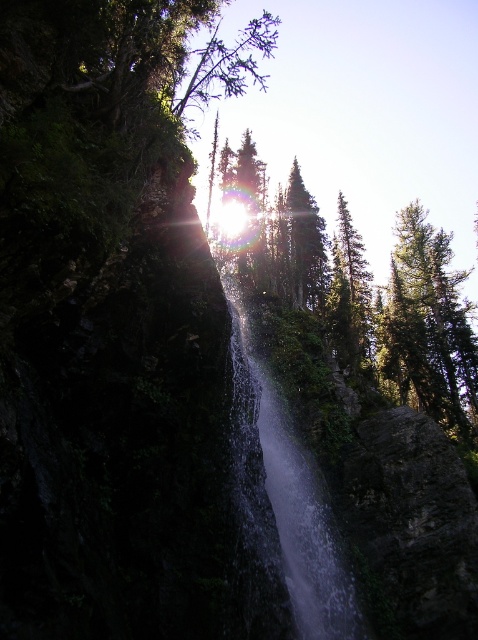
Is point (356, 352) farther from camera compared to point (306, 262)?

No.

The image size is (478, 640). I want to click on green matte tree at upper center, so click(x=348, y=292).

Is green textured tree at center behind green textured tree at upper center?

No, it is not.

Between green textured tree at center and green textured tree at upper center, which one has more height?

green textured tree at center

Is point (304, 228) positioned before point (313, 296)?

That is True.

I want to click on green textured tree at center, so click(359, 291).

Does green textured tree at center have a lesser height compared to clear water at center?

No.

Who is shorter, green textured tree at center or clear water at center?

clear water at center

Is point (393, 352) more distant than point (302, 588)?

That is True.

I want to click on green textured tree at center, so click(x=359, y=291).